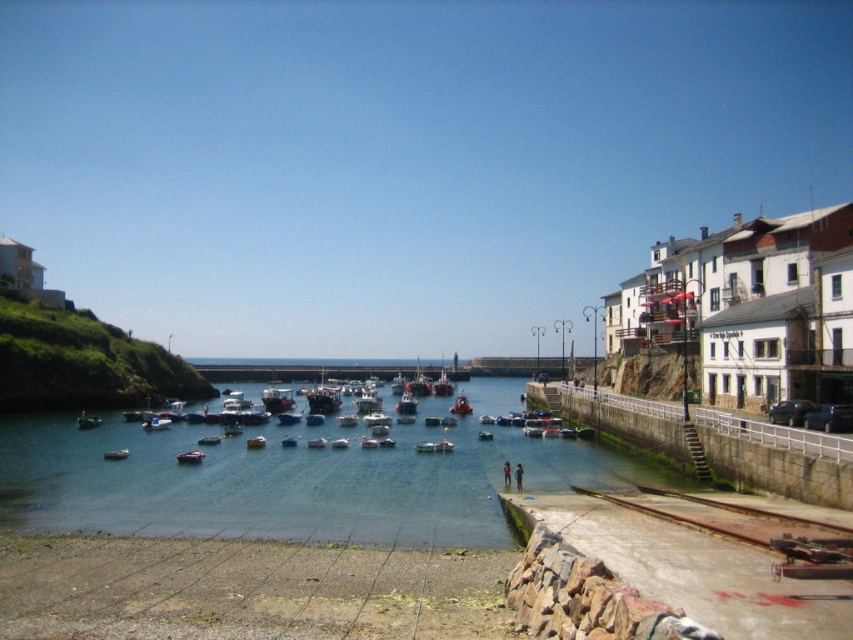
You are standing on the walkway in the foreground of the coastal scene. You notice two points marked in the image. Which point, point (181, 461) or point (204, 438), is closer to you?

Point (181, 461) is closer to the viewer than point (204, 438).